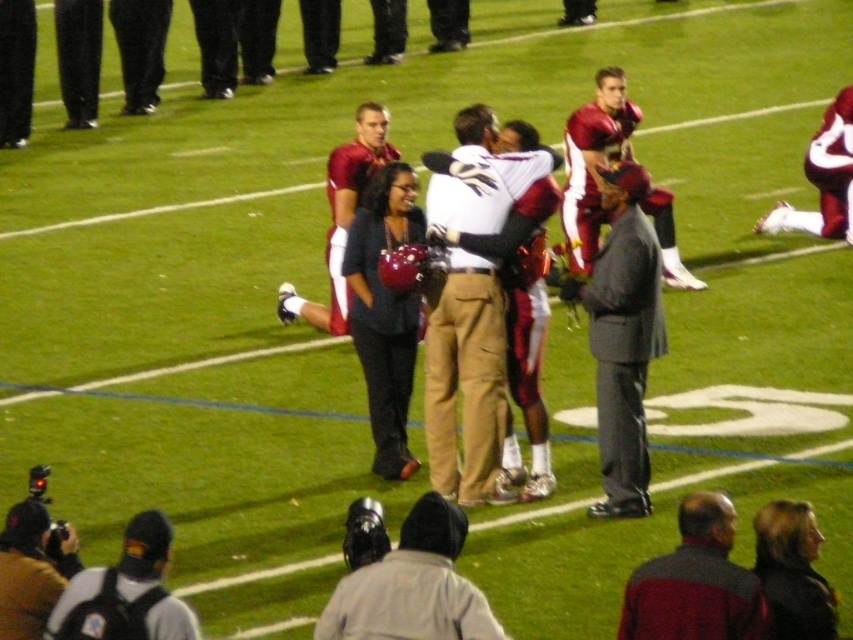
Looking at this image, you are a photographer at the football field and you need to capture a photo of the gray fabric jacket at lower center and the maroon uniform at center. According to their positions, which one is located to the left of the other?

The gray fabric jacket at lower center is positioned on the left side of maroon uniform at center, so the gray fabric jacket at lower center is to the left of the maroon uniform at center.

You are a photographer positioned at the edge of the football field. You need to capture a photo of the maroon fabric uniform at center and the gray suit at center. Based on their sizes, which one should you zoom in on more to ensure both are clearly visible in the frame?

The maroon fabric uniform at center is bigger than the gray suit at center, so you should zoom in slightly more on the gray suit at center to balance their sizes in the photo.

You are a photographer at the football field ceremony. You need to capture a photo of both the maroon fabric uniform at center and the gray suit at center. Based on their positions, which one is positioned higher in the frame?

The maroon fabric uniform at center is located above the gray suit at center, so it is positioned higher in the frame.